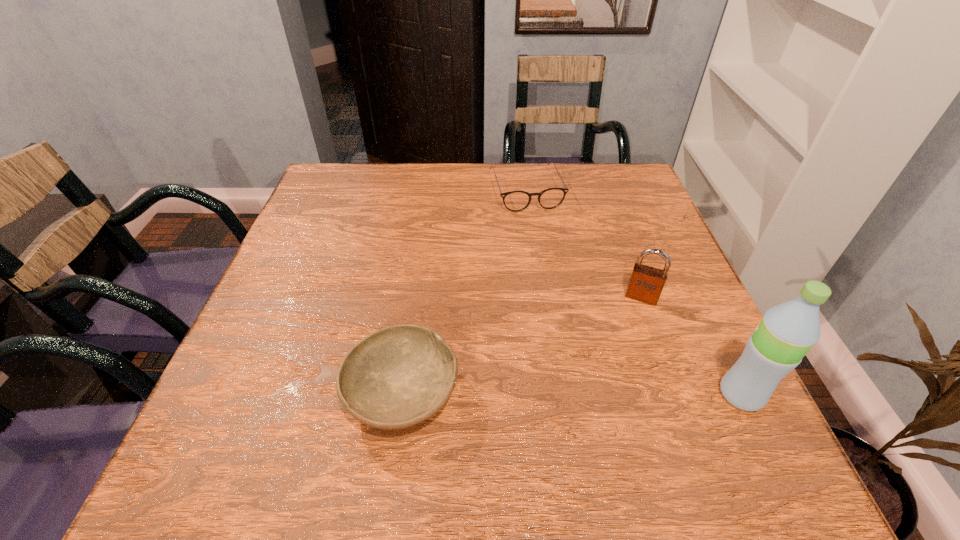
Where is `vacant space on the desktop that is between the bowl and the tallest object and is positioned on the front-facing side of the second farthest object`? vacant space on the desktop that is between the bowl and the tallest object and is positioned on the front-facing side of the second farthest object is located at coordinates (617, 394).

Locate an element on the screen. The height and width of the screenshot is (540, 960). free space on the desktop that is between the third tallest object and the water bottle and is positioned through the lenses of the second object from left to right is located at coordinates (605, 394).